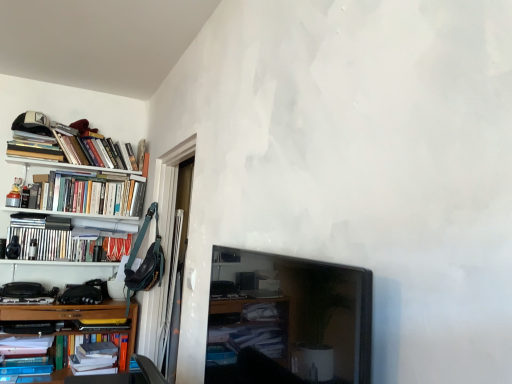
What are the coordinates of `hardcover books at upper left, marked as the 2th book in a top-to-bottom arrangement` in the screenshot? It's located at (80, 148).

What do you see at coordinates (95, 359) in the screenshot?
I see `hardcover book at lower left, the 1th book in the bottom-to-top sequence` at bounding box center [95, 359].

Identify the location of hardcover books at left, the first book in the top-to-bottom sequence. (34, 146).

Between hardcover book at lower left, acting as the sixth book starting from the top, and hardcover books at left, which is the fourth book from top to bottom, which one has smaller size?

With smaller size is hardcover book at lower left, acting as the sixth book starting from the top.

Is hardcover book at lower left, arranged as the second book when ordered from the bottom, wider or thinner than hardcover books at left, which is the fourth book from top to bottom?

In the image, hardcover book at lower left, arranged as the second book when ordered from the bottom, appears to be wider than hardcover books at left, which is the fourth book from top to bottom.

Identify the location of the 2nd book above the hardcover book at lower left, arranged as the second book when ordered from the bottom (from a real-world perspective). (67, 238).

What's the angular difference between hardcover books at left, which appears as the fourth book when ordered from the bottom, and hardcover books at left, which is counted as the fifth book, starting from the bottom,'s facing directions?

There is a 0.000132-degree angle between the facing directions of hardcover books at left, which appears as the fourth book when ordered from the bottom, and hardcover books at left, which is counted as the fifth book, starting from the bottom.

Can you confirm if hardcover books at left, which is the fourth book from top to bottom, is positioned to the left of hardcover books at left, the third book in the top-to-bottom sequence?

Yes.

Is hardcover books at left, which appears as the fourth book when ordered from the bottom, far from hardcover books at left, the third book in the top-to-bottom sequence?

hardcover books at left, which appears as the fourth book when ordered from the bottom, is actually quite close to hardcover books at left, the third book in the top-to-bottom sequence.

Does point (115, 214) appear closer or farther from the camera than point (358, 363)?

Point (115, 214) is positioned farther from the camera compared to point (358, 363).

From the picture: Who is smaller, hardcover books at left, the third book in the top-to-bottom sequence, or matte black tv at center?

Smaller between the two is matte black tv at center.

In the image, is hardcover books at left, the third book in the top-to-bottom sequence, positioned in front of or behind matte black tv at center?

hardcover books at left, the third book in the top-to-bottom sequence, is behind matte black tv at center.

I want to click on picture frame below the hardcover books at left, the third book in the top-to-bottom sequence (from the image's perspective), so click(287, 320).

Is the surface of hardcover book at lower left, the 1th book in the bottom-to-top sequence, in direct contact with hardcover book at lower left, arranged as the second book when ordered from the bottom?

No, hardcover book at lower left, the 1th book in the bottom-to-top sequence, is not making contact with hardcover book at lower left, arranged as the second book when ordered from the bottom.

Find the location of a particular element. This screenshot has height=384, width=512. the 1st book behind the hardcover book at lower left, acting as the sixth book starting from the top is located at coordinates (95, 359).

Between hardcover book at lower left, placed as the 7th book when sorted from top to bottom, and hardcover book at lower left, acting as the sixth book starting from the top, which one has larger size?

hardcover book at lower left, acting as the sixth book starting from the top, is bigger.

Considering the positions of points (109, 362) and (15, 366), is point (109, 362) closer to camera compared to point (15, 366)?

No.

Consider the image. From a real-world perspective, who is located lower, hardcover books at left, marked as the 5th book in a top-to-bottom arrangement, or hardcover books at left, the first book in the top-to-bottom sequence?

hardcover books at left, marked as the 5th book in a top-to-bottom arrangement, is physically lower.

Which of these two, hardcover books at left, marked as the 5th book in a top-to-bottom arrangement, or hardcover books at left, the first book in the top-to-bottom sequence, is bigger?

Bigger between the two is hardcover books at left, marked as the 5th book in a top-to-bottom arrangement.

Does hardcover books at left, marked as the 5th book in a top-to-bottom arrangement, turn towards hardcover books at left, which appears as the seventh book when ordered from the bottom?

No, hardcover books at left, marked as the 5th book in a top-to-bottom arrangement, does not turn towards hardcover books at left, which appears as the seventh book when ordered from the bottom.

How far apart are hardcover books at left, marked as the 5th book in a top-to-bottom arrangement, and hardcover books at left, the first book in the top-to-bottom sequence?

The distance of hardcover books at left, marked as the 5th book in a top-to-bottom arrangement, from hardcover books at left, the first book in the top-to-bottom sequence, is 1.18 meters.

Who is shorter, hardcover book at lower left, the 1th book in the bottom-to-top sequence, or hardcover books at left, which is the 3th book from bottom to top?

hardcover book at lower left, the 1th book in the bottom-to-top sequence.

Is hardcover book at lower left, placed as the 7th book when sorted from top to bottom, further to the viewer compared to hardcover books at left, marked as the 5th book in a top-to-bottom arrangement?

That is True.

Considering the relative sizes of hardcover book at lower left, the 1th book in the bottom-to-top sequence, and hardcover books at left, marked as the 5th book in a top-to-bottom arrangement, in the image provided, is hardcover book at lower left, the 1th book in the bottom-to-top sequence, wider than hardcover books at left, marked as the 5th book in a top-to-bottom arrangement,?

No.

Between hardcover book at lower left, the 1th book in the bottom-to-top sequence, and hardcover books at left, which is the 3th book from bottom to top, which one has larger size?

Bigger between the two is hardcover books at left, which is the 3th book from bottom to top.

Looking at this image, is the depth of hardcover book at lower left, acting as the sixth book starting from the top, less than that of matte black tv at center?

No, it is not.

Is point (21, 342) positioned in front of point (360, 278)?

That is False.

Is hardcover book at lower left, arranged as the second book when ordered from the bottom, aimed at matte black tv at center?

Yes, hardcover book at lower left, arranged as the second book when ordered from the bottom, is facing matte black tv at center.

In the scene shown: From the image's perspective, which is above, hardcover book at lower left, acting as the sixth book starting from the top, or matte black tv at center?

matte black tv at center is shown above in the image.

This screenshot has width=512, height=384. What are the coordinates of `the 2nd book behind when counting from the hardcover book at lower left, arranged as the second book when ordered from the bottom` in the screenshot? It's located at (67, 238).

At what (x,y) coordinates should I click in order to perform the action: click on the 2nd book to the right of the hardcover books at left, which appears as the fourth book when ordered from the bottom, counting from the anchor's position. Please return your answer as a coordinate pair (x, y). The width and height of the screenshot is (512, 384). Looking at the image, I should click on (90, 194).

Based on their spatial positions, is hardcover books at left, the first book in the top-to-bottom sequence, or hardcover books at left, which appears as the fourth book when ordered from the bottom, closer to hardcover books at upper left, the sixth book positioned from the bottom?

The object closer to hardcover books at upper left, the sixth book positioned from the bottom, is hardcover books at left, the first book in the top-to-bottom sequence.

Estimate the real-world distances between objects in this image. Which object is closer to hardcover book at lower left, the 1th book in the bottom-to-top sequence, hardcover books at upper left, marked as the 2th book in a top-to-bottom arrangement, or hardcover books at left, marked as the 5th book in a top-to-bottom arrangement?

hardcover books at left, marked as the 5th book in a top-to-bottom arrangement.

Which object lies further to the anchor point matte black tv at center, hardcover books at left, which appears as the fourth book when ordered from the bottom, or hardcover books at upper left, the sixth book positioned from the bottom?

hardcover books at upper left, the sixth book positioned from the bottom, is further to matte black tv at center.

When comparing their distances from hardcover books at left, which is counted as the fifth book, starting from the bottom, does hardcover books at left, which appears as the seventh book when ordered from the bottom, or hardcover books at left, which appears as the fourth book when ordered from the bottom, seem closer?

Based on the image, hardcover books at left, which appears as the fourth book when ordered from the bottom, appears to be nearer to hardcover books at left, which is counted as the fifth book, starting from the bottom.

Estimate the real-world distances between objects in this image. Which object is further from hardcover books at left, marked as the 5th book in a top-to-bottom arrangement, hardcover books at left, which appears as the seventh book when ordered from the bottom, or hardcover books at left, which appears as the fourth book when ordered from the bottom?

The object further to hardcover books at left, marked as the 5th book in a top-to-bottom arrangement, is hardcover books at left, which appears as the seventh book when ordered from the bottom.

Looking at the image, which one is located closer to hardcover books at left, which appears as the fourth book when ordered from the bottom, hardcover book at lower left, acting as the sixth book starting from the top, or hardcover books at upper left, the sixth book positioned from the bottom?

hardcover books at upper left, the sixth book positioned from the bottom, is closer to hardcover books at left, which appears as the fourth book when ordered from the bottom.

When comparing their distances from hardcover books at left, the first book in the top-to-bottom sequence, does hardcover books at left, the third book in the top-to-bottom sequence, or hardcover book at lower left, acting as the sixth book starting from the top, seem closer?

hardcover books at left, the third book in the top-to-bottom sequence, is closer to hardcover books at left, the first book in the top-to-bottom sequence.

When comparing their distances from hardcover books at left, marked as the 5th book in a top-to-bottom arrangement, does matte black tv at center or hardcover book at lower left, placed as the 7th book when sorted from top to bottom, seem further?

matte black tv at center lies further to hardcover books at left, marked as the 5th book in a top-to-bottom arrangement, than the other object.

Where is `book between hardcover books at left, the third book in the top-to-bottom sequence, and hardcover books at left, which is the 3th book from bottom to top, in the vertical direction`? Image resolution: width=512 pixels, height=384 pixels. book between hardcover books at left, the third book in the top-to-bottom sequence, and hardcover books at left, which is the 3th book from bottom to top, in the vertical direction is located at coordinates (67, 238).

At what (x,y) coordinates should I click in order to perform the action: click on book positioned between matte black tv at center and hardcover book at lower left, arranged as the second book when ordered from the bottom, from near to far. Please return your answer as a coordinate pair (x, y). This screenshot has width=512, height=384. Looking at the image, I should click on (106, 363).

Where is `book between hardcover books at upper left, the sixth book positioned from the bottom, and hardcover books at left, which is the fourth book from top to bottom, in the vertical direction`? This screenshot has height=384, width=512. book between hardcover books at upper left, the sixth book positioned from the bottom, and hardcover books at left, which is the fourth book from top to bottom, in the vertical direction is located at coordinates (90, 194).

You are a GUI agent. You are given a task and a screenshot of the screen. Output one action in this format:
    pyautogui.click(x=<x>, y=<y>)
    Task: Click on the book between hardcover books at left, which appears as the fourth book when ordered from the bottom, and hardcover book at lower left, arranged as the second book when ordered from the bottom, in the vertical direction
    Image resolution: width=512 pixels, height=384 pixels.
    Given the screenshot: What is the action you would take?
    pyautogui.click(x=106, y=363)